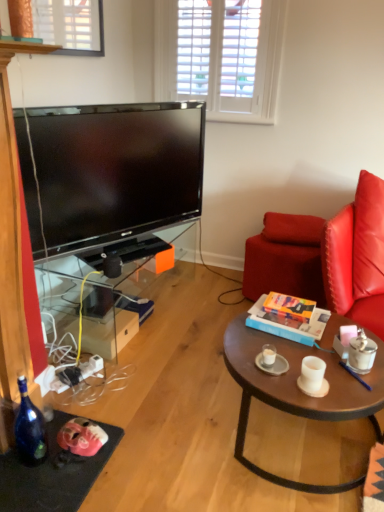
Question: From the image's perspective, is transparent glass tv stand at left on white matte coffee cup at center, the third coffee cup positioned from the right?

Choices:
 (A) yes
 (B) no

Answer: (A)

Question: Can we say transparent glass tv stand at left lies outside white matte coffee cup at center, the third coffee cup positioned from the right?

Choices:
 (A) yes
 (B) no

Answer: (A)

Question: Is transparent glass tv stand at left taller than white matte coffee cup at center, acting as the 1th coffee cup starting from the left?

Choices:
 (A) yes
 (B) no

Answer: (A)

Question: From a real-world perspective, is transparent glass tv stand at left located beneath white matte coffee cup at center, the third coffee cup positioned from the right?

Choices:
 (A) no
 (B) yes

Answer: (B)

Question: Is transparent glass tv stand at left facing towards white matte coffee cup at center, acting as the 1th coffee cup starting from the left?

Choices:
 (A) no
 (B) yes

Answer: (B)

Question: Is white matte coffee cup at center, the third coffee cup positioned from the right, located within transparent glass tv stand at left?

Choices:
 (A) no
 (B) yes

Answer: (A)

Question: Considering the relative sizes of metallic silver coffee cup at right, which ranks as the 1th coffee cup in right-to-left order, and leather swivel chair at right in the image provided, is metallic silver coffee cup at right, which ranks as the 1th coffee cup in right-to-left order, wider than leather swivel chair at right?

Choices:
 (A) no
 (B) yes

Answer: (A)

Question: Is metallic silver coffee cup at right, which ranks as the 1th coffee cup in right-to-left order, to the left of leather swivel chair at right from the viewer's perspective?

Choices:
 (A) no
 (B) yes

Answer: (B)

Question: Does metallic silver coffee cup at right, placed as the 3th coffee cup when sorted from left to right, lie behind leather swivel chair at right?

Choices:
 (A) no
 (B) yes

Answer: (A)

Question: Does metallic silver coffee cup at right, placed as the 3th coffee cup when sorted from left to right, come in front of leather swivel chair at right?

Choices:
 (A) yes
 (B) no

Answer: (A)

Question: Can leather swivel chair at right be found inside metallic silver coffee cup at right, placed as the 3th coffee cup when sorted from left to right?

Choices:
 (A) yes
 (B) no

Answer: (B)

Question: Does metallic silver coffee cup at right, placed as the 3th coffee cup when sorted from left to right, have a smaller size compared to leather swivel chair at right?

Choices:
 (A) no
 (B) yes

Answer: (B)

Question: Can you confirm if red leather pillow at right is shorter than black plastic pen at center?

Choices:
 (A) yes
 (B) no

Answer: (B)